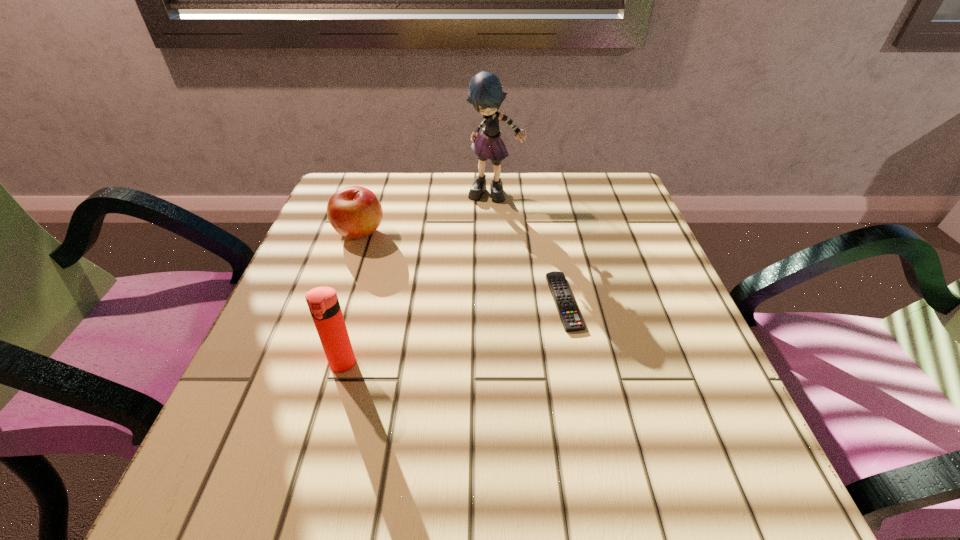
Locate an element on the screen. vacant space at the right edge is located at coordinates (655, 308).

This screenshot has width=960, height=540. I want to click on vacant space at the near left corner, so click(x=278, y=491).

Find the location of a particular element. free location at the far right corner of the desktop is located at coordinates (612, 194).

This screenshot has height=540, width=960. In the image, there is a desktop. In order to click on free region at the near right corner in this screenshot , I will do `click(730, 475)`.

Locate an element on the screen. The image size is (960, 540). vacant space in between the second shortest object and the second nearest object is located at coordinates (462, 267).

The image size is (960, 540). I want to click on empty location between the rag doll and the shortest object, so click(529, 248).

Locate an element on the screen. vacant point located between the second object from right to left and the nearest object is located at coordinates (419, 280).

Where is `free spot between the second object from right to left and the remote control`? The image size is (960, 540). free spot between the second object from right to left and the remote control is located at coordinates (529, 248).

Where is `free area in between the second farthest object and the rag doll`? free area in between the second farthest object and the rag doll is located at coordinates (427, 213).

Where is `vacant area between the second tallest object and the third farthest object`? This screenshot has height=540, width=960. vacant area between the second tallest object and the third farthest object is located at coordinates (453, 333).